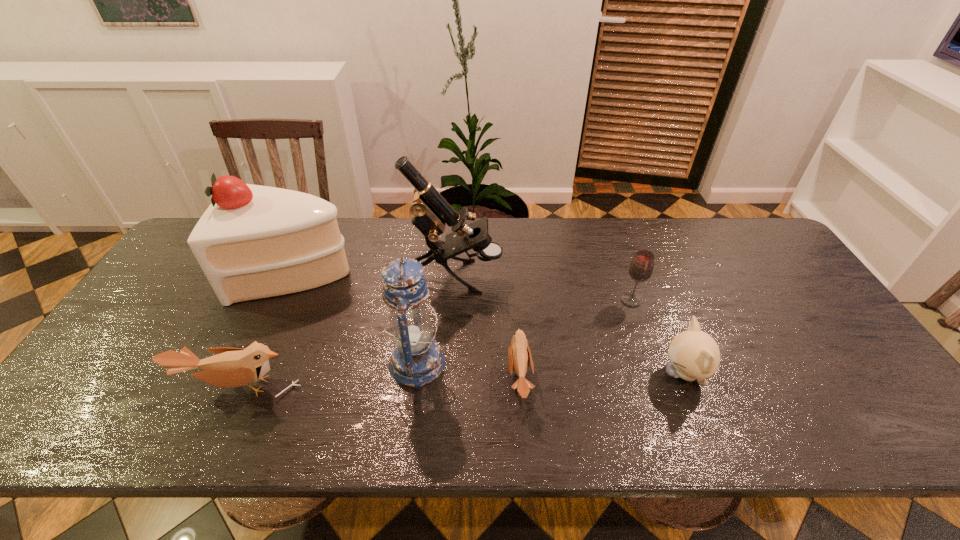
Image resolution: width=960 pixels, height=540 pixels. In order to click on the taller bird in this screenshot , I will do `click(232, 367)`.

Find the location of a particular element. The width and height of the screenshot is (960, 540). the right bird is located at coordinates (519, 355).

Locate an element on the screen. This screenshot has height=540, width=960. the shortest object is located at coordinates (519, 355).

Where is `cake`? cake is located at coordinates 252,242.

Identify the location of microscope. pos(431,211).

At what (x,y) coordinates should I click in order to perform the action: click on glass drink container. Please return your answer as a coordinate pair (x, y). Looking at the image, I should click on (641, 267).

Locate an element on the screen. lantern is located at coordinates (416, 360).

You are a GUI agent. You are given a task and a screenshot of the screen. Output one action in this format:
    pyautogui.click(x=<x>, y=<y>)
    Task: Click on the kitten
    
    Given the screenshot: What is the action you would take?
    pyautogui.click(x=694, y=354)

You are a GUI agent. You are given a task and a screenshot of the screen. Output one action in this format:
    pyautogui.click(x=<x>, y=<y>)
    Task: Click on the vacant space located 0.260m at the beak of the shorter bird
    The width and height of the screenshot is (960, 540).
    Given the screenshot: What is the action you would take?
    pyautogui.click(x=640, y=379)

Image resolution: width=960 pixels, height=540 pixels. I want to click on free region located 0.050m on the back of the cake, so click(314, 234).